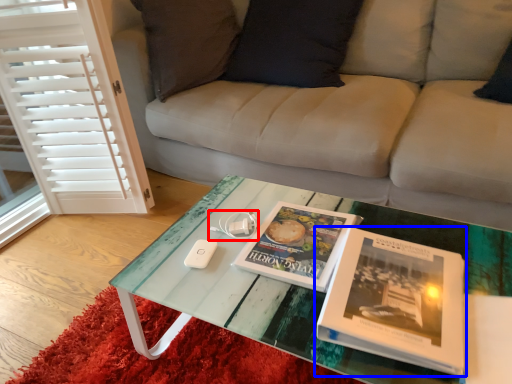
Question: Which object appears farthest to the camera in this image, game controller (highlighted by a red box) or book (highlighted by a blue box)?

Choices:
 (A) game controller
 (B) book

Answer: (A)